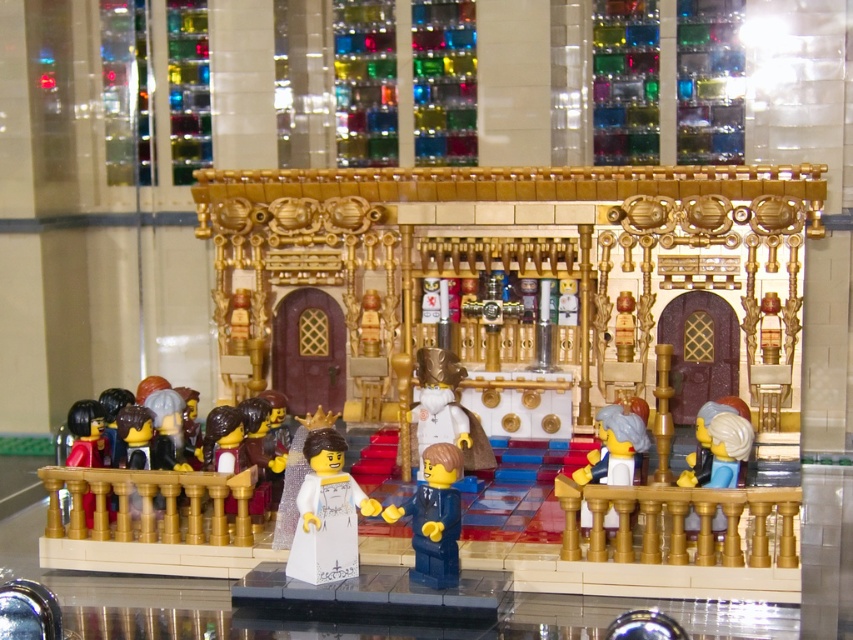
You are a visitor standing in front of the LEGO throne room. You see a white matte minifigure at right and a matte black minifigure at lower left. Which minifigure is positioned lower in height compared to the other?

The white matte minifigure at right is below the matte black minifigure at lower left, so the white matte minifigure at right is positioned lower in height.

You are a visitor standing at the entrance of the LEGO throne room. You see a white glossy minifigure at center and a matte black minifigure at lower left. Which minifigure is positioned closer to the ground?

The white glossy minifigure at center is below matte black minifigure at lower left, so the white glossy minifigure at center is closer to the ground.

You are standing in front of the LEGO throne room and notice two points marked on the structure. The first point is at coordinates point (x=430, y=522), and the second is at point (x=68, y=461). If you were to walk towards the throne room, which point would you encounter first?

Point (x=430, y=522) is closer to the viewer than point (x=68, y=461), so you would encounter point (x=430, y=522) first as you walk towards the throne room.